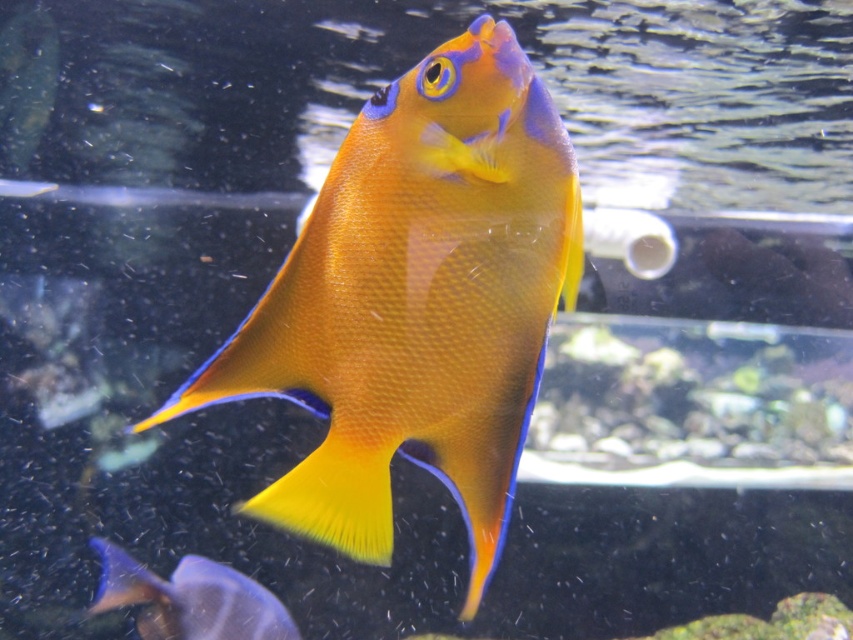
You are an aquarium maintenance worker who needs to identify the taller fish between the matte orange fish at center and the blue glossy fish at lower left. Which one is taller?

The matte orange fish at center is taller than the blue glossy fish at lower left.

You are an aquarium maintenance robot tasked with cleaning the tank. You need to avoid the matte orange fish at center while moving from the left side of the tank to the right side. Can you safely navigate around it without getting too close?

The matte orange fish at center is located at point (x=416, y=301), which is near the center of the tank. Since you need to move from the left to the right side, you can safely navigate around it by staying close to the bottom or top of the tank, maintaining a safe distance from the fish.